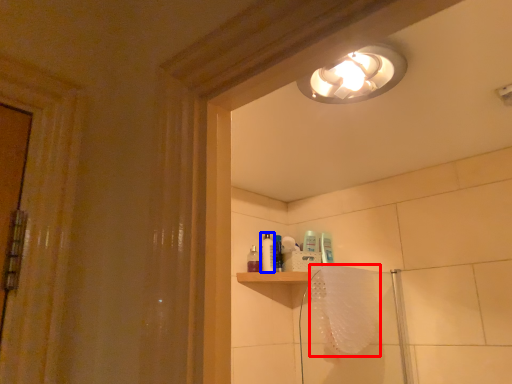
Question: Which object appears closest to the camera in this image, bath towel (highlighted by a red box) or toiletry (highlighted by a blue box)?

Choices:
 (A) bath towel
 (B) toiletry

Answer: (A)